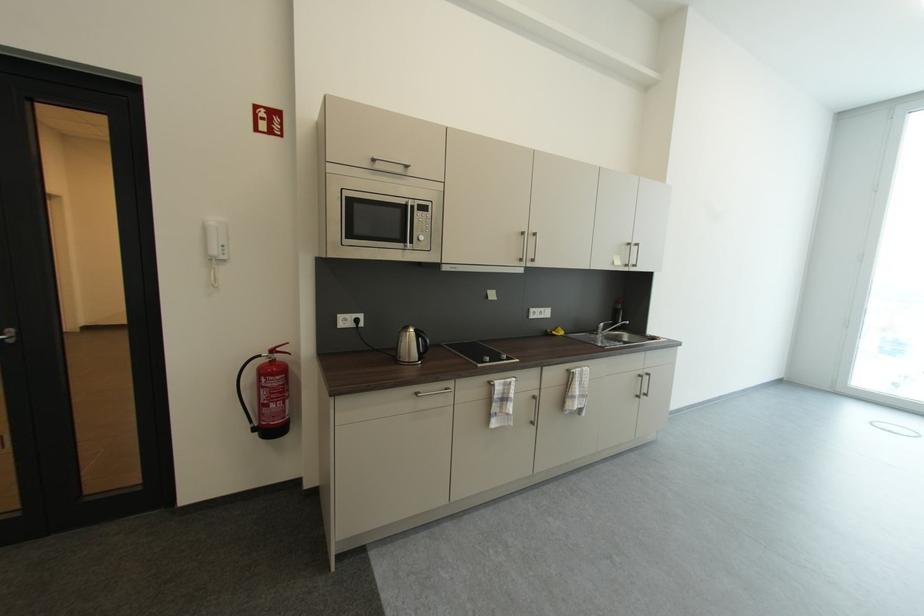
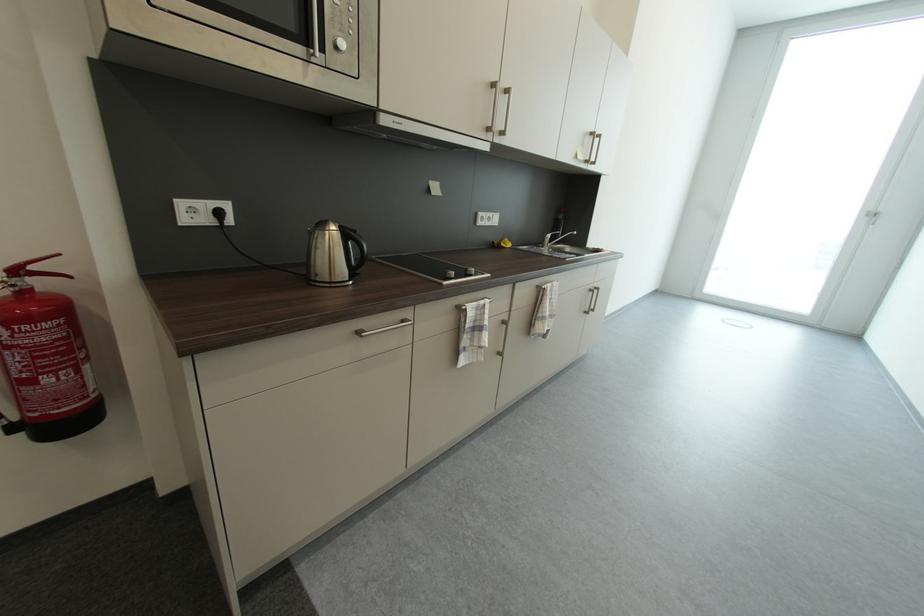
The point at (x=622, y=265) is marked in the first image. Where is the corresponding point in the second image?

(585, 160)